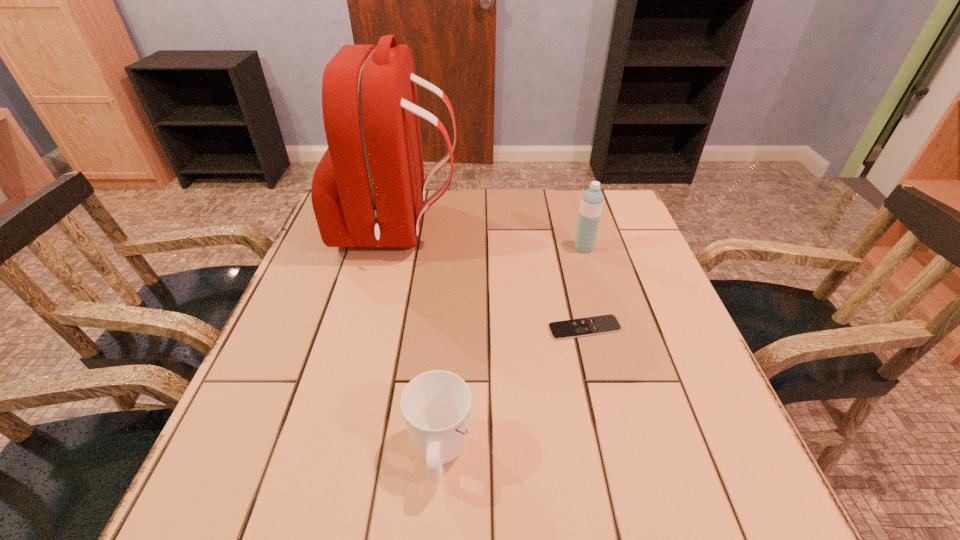
I want to click on free space located 0.310m on the side of the third tallest object with the handle, so click(451, 295).

What are the coordinates of `free location located on the back of the shortest object` in the screenshot? It's located at (571, 273).

Image resolution: width=960 pixels, height=540 pixels. I want to click on object that is at the far edge, so click(368, 190).

Find the location of `object at the near edge`. object at the near edge is located at coordinates (436, 405).

Where is `object that is at the left edge`? object that is at the left edge is located at coordinates (368, 190).

Locate an element on the screen. Image resolution: width=960 pixels, height=540 pixels. water bottle that is at the right edge is located at coordinates (592, 200).

Find the location of `remote control present at the right edge`. remote control present at the right edge is located at coordinates (602, 324).

You are a GUI agent. You are given a task and a screenshot of the screen. Output one action in this format:
    pyautogui.click(x=<x>, y=<y>)
    Task: Click on the object at the far left corner
    
    Given the screenshot: What is the action you would take?
    pyautogui.click(x=368, y=190)

In the image, there is a desktop. Identify the location of vacant area at the far edge. (492, 222).

In the image, there is a desktop. At what (x,y) coordinates should I click in order to perform the action: click on free space at the near edge. Please return your answer as a coordinate pair (x, y). The width and height of the screenshot is (960, 540). Looking at the image, I should click on (624, 515).